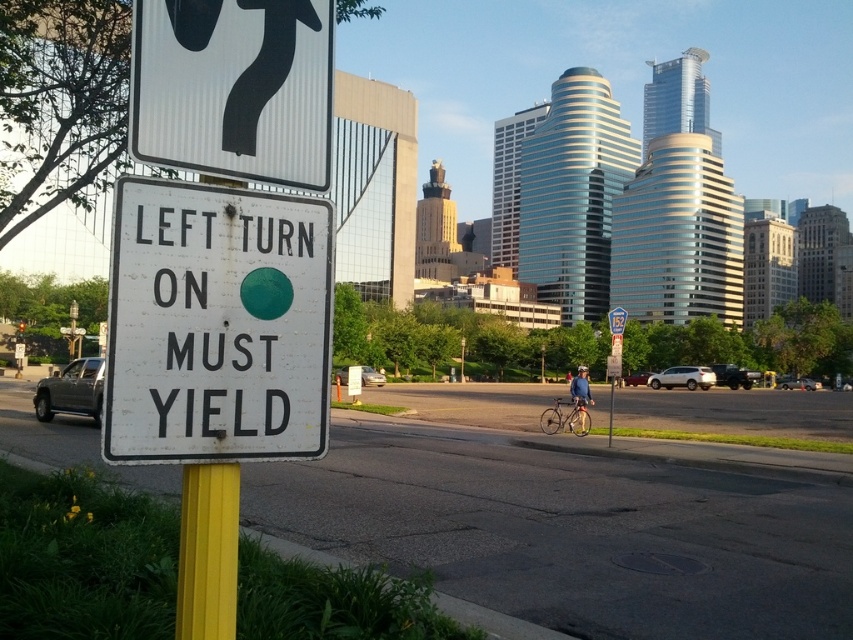
Question: Does white corrugated plastic sign at upper left have a larger size compared to blue fabric jacket at center?

Choices:
 (A) no
 (B) yes

Answer: (A)

Question: Among these objects, which one is nearest to the camera?

Choices:
 (A) silver metallic bicycle at center
 (B) yellow painted metal pole at lower left
 (C) white paper sign at center

Answer: (C)

Question: Is white corrugated plastic sign at upper left to the right of blue fabric jacket at center from the viewer's perspective?

Choices:
 (A) yes
 (B) no

Answer: (B)

Question: Which of the following is the farthest from the observer?

Choices:
 (A) (276, 108)
 (B) (181, 211)
 (C) (572, 419)
 (D) (583, 426)

Answer: (D)

Question: Does white corrugated plastic sign at upper left have a smaller size compared to yellow painted metal pole at lower left?

Choices:
 (A) yes
 (B) no

Answer: (B)

Question: Which of these objects is positioned farthest from the white paper sign at center?

Choices:
 (A) yellow painted metal pole at lower left
 (B) silver metallic bicycle at center
 (C) white corrugated plastic sign at upper left

Answer: (B)